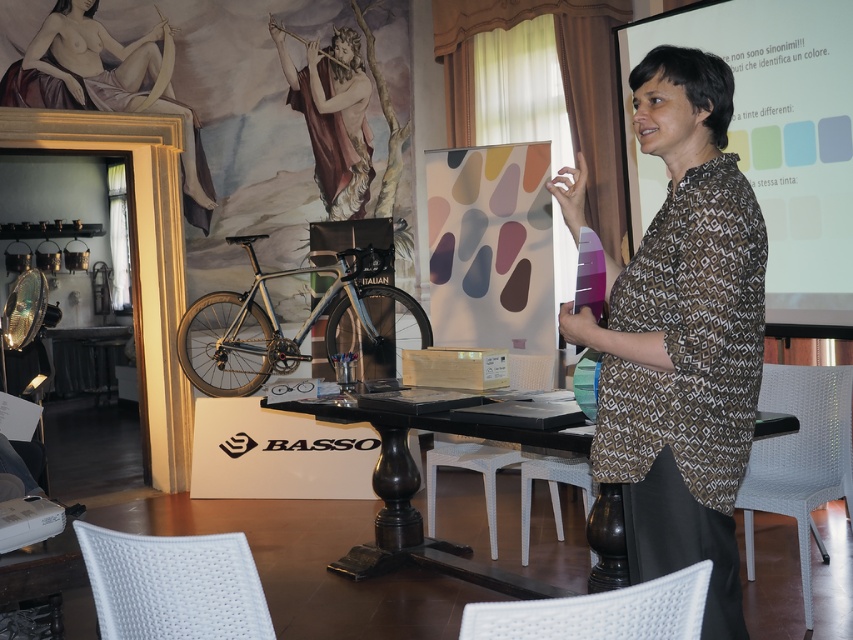
Is the position of black glossy table at center more distant than that of matte gold flute at upper center?

No.

Measure the distance between black glossy table at center and camera.

black glossy table at center is 2.92 meters away from camera.

Who is more forward, (498, 572) or (322, 196)?

Point (498, 572) is more forward.

The image size is (853, 640). Find the location of `black glossy table at center`. black glossy table at center is located at coordinates (413, 492).

Is point (355, 285) farther from camera compared to point (398, 480)?

That is True.

Who is more forward, [345,284] or [463,554]?

Point [463,554] is in front.

In order to click on silver metallic bicycle at center in this screenshot , I will do pyautogui.click(x=279, y=324).

Who is more distant from viewer, (x=773, y=163) or (x=318, y=116)?

Positioned behind is point (x=318, y=116).

Can you confirm if white paper at upper right is positioned to the right of matte gold flute at upper center?

Yes, white paper at upper right is to the right of matte gold flute at upper center.

Between point (817, 10) and point (297, 108), which one is positioned in front?

Point (817, 10)

Find the location of `white paper at upper right`. white paper at upper right is located at coordinates (769, 141).